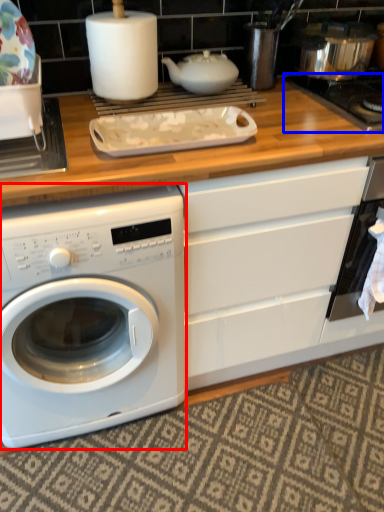
Question: Among these objects, which one is nearest to the camera, washing machine (highlighted by a red box) or gas stove (highlighted by a blue box)?

Choices:
 (A) washing machine
 (B) gas stove

Answer: (A)